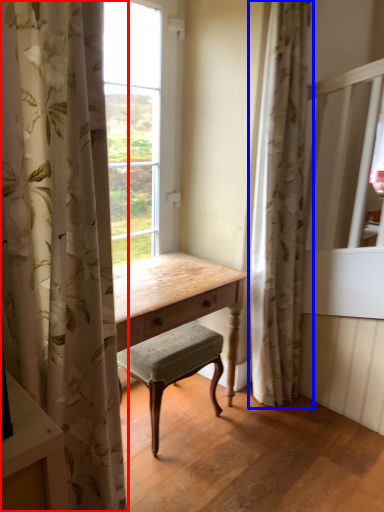
Question: Which object appears closest to the camera in this image, curtain (highlighted by a red box) or curtain (highlighted by a blue box)?

Choices:
 (A) curtain
 (B) curtain

Answer: (A)